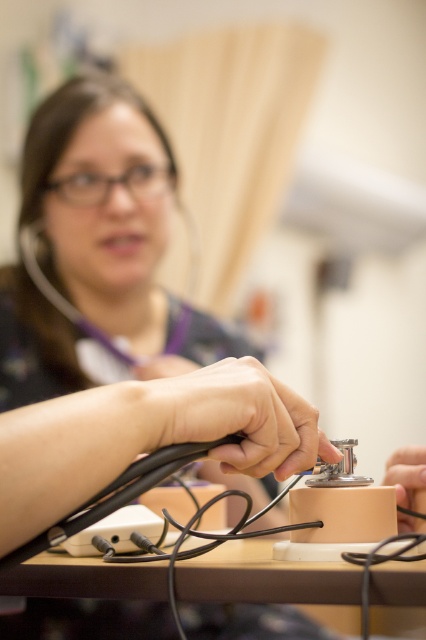
Question: Which point is closer to the camera?

Choices:
 (A) wooden table at center
 (B) matte black stethoscope at lower right
 (C) matte black stethoscope at center

Answer: (C)

Question: Estimate the real-world distances between objects in this image. Which object is farther from the matte black stethoscope at center?

Choices:
 (A) matte black stethoscope at lower right
 (B) wooden table at center

Answer: (B)

Question: Where is matte black stethoscope at center located in relation to matte black stethoscope at lower right in the image?

Choices:
 (A) above
 (B) below

Answer: (A)

Question: Can you confirm if matte black stethoscope at center is wider than matte black stethoscope at lower right?

Choices:
 (A) yes
 (B) no

Answer: (A)

Question: Where is wooden table at center located in relation to matte black stethoscope at center in the image?

Choices:
 (A) left
 (B) right

Answer: (A)

Question: Which object is closer to the camera taking this photo?

Choices:
 (A) matte black stethoscope at center
 (B) wooden table at center
 (C) matte black stethoscope at lower right

Answer: (A)